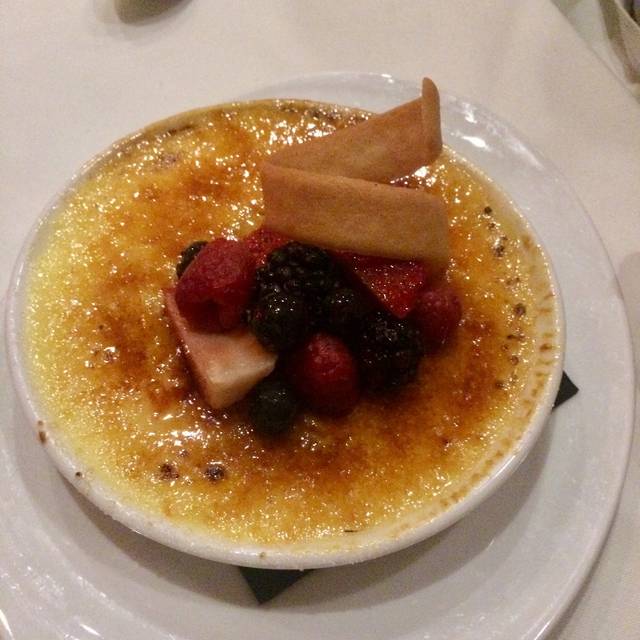
This screenshot has width=640, height=640. Identify the location of napkin. (262, 582).